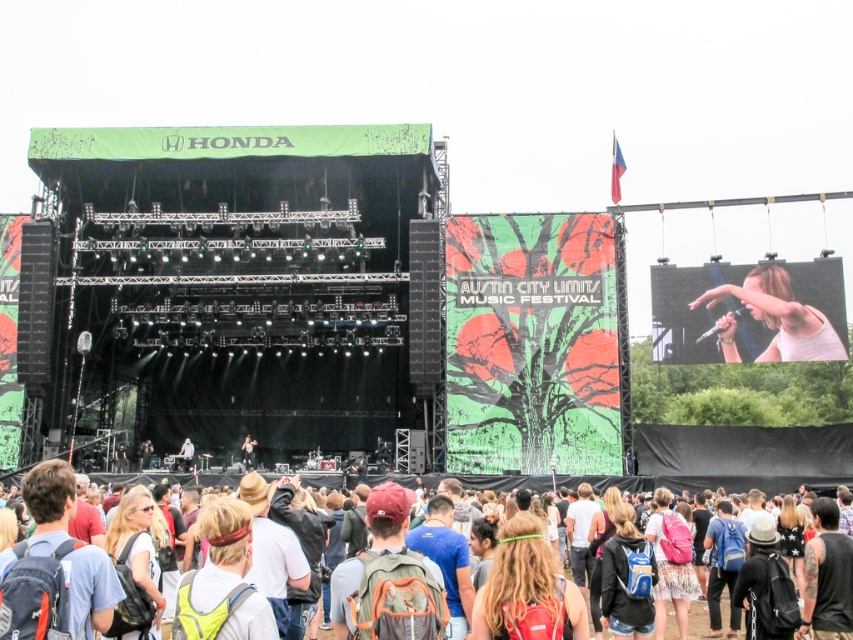
Question: Is white fabric at center to the left of matte black jacket at center from the viewer's perspective?

Choices:
 (A) yes
 (B) no

Answer: (A)

Question: In this image, where is white fabric at center located relative to matte black jacket at center?

Choices:
 (A) below
 (B) above

Answer: (A)

Question: Which object is the farthest from the white cotton shirt at lower center?

Choices:
 (A) white matte shirt at upper right
 (B) white fabric at center

Answer: (B)

Question: Can you confirm if white matte shirt at upper right is positioned below matte black jacket at center?

Choices:
 (A) no
 (B) yes

Answer: (A)

Question: Which point is closer to the camera?

Choices:
 (A) (247, 435)
 (B) (183, 442)
 (C) (596, 484)

Answer: (C)

Question: Which point is farther from the camera taking this photo?

Choices:
 (A) (250, 467)
 (B) (184, 451)
 (C) (662, 577)
 (D) (770, 269)

Answer: (B)